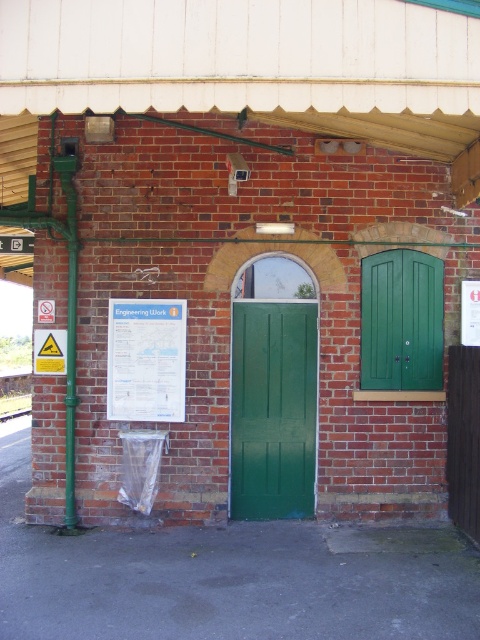
You are standing near the brick building and want to find the entrance. There is a brushed metal sign at upper left and a metal train track at lower left. Which object is closer to the ground?

The metal train track at lower left is closer to the ground because it is located below the brushed metal sign at upper left.

You are standing in front of a building with a green wooden door at right and a metal train track at lower left. Which object is positioned to the right side of the other?

The green wooden door at right is to the right of the metal train track at lower left.

You are standing in front of the brick building and want to read the text on the brushed metal sign at upper left. Can you read it clearly from your current position?

The brushed metal sign at upper left is 8.40 meters from viewer, so it is too far away to read the text clearly from your current position.